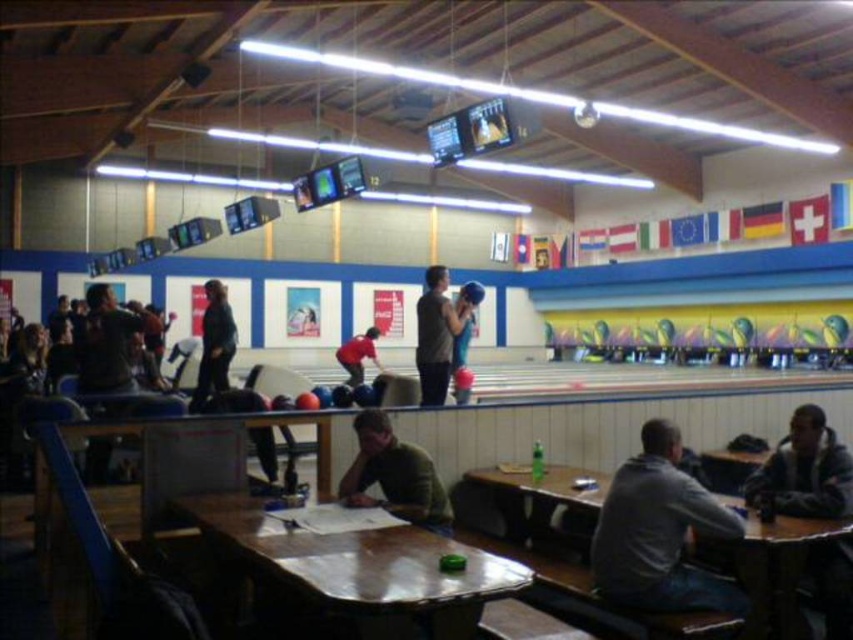
Question: Estimate the real-world distances between objects in this image. Which object is farther from the dark gray fabric jacket at center?

Choices:
 (A) blue fabric shirt at center
 (B) red fabric shirt at center
 (C) gray cotton shirt at lower right
 (D) matte blue bowling ball at center

Answer: (C)

Question: Can you confirm if blue fabric shirt at center is smaller than red fabric shirt at center?

Choices:
 (A) no
 (B) yes

Answer: (B)

Question: Is wooden table at lower right thinner than dark gray jacket at lower right?

Choices:
 (A) yes
 (B) no

Answer: (B)

Question: Considering the real-world distances, which object is farthest from the red fabric shirt at center?

Choices:
 (A) wooden table at center
 (B) gray cotton shirt at lower right

Answer: (A)

Question: Does wooden table at lower right appear over dark gray jacket at lower right?

Choices:
 (A) yes
 (B) no

Answer: (B)

Question: Considering the real-world distances, which object is farthest from the red fabric shirt at center?

Choices:
 (A) matte blue bowling ball at center
 (B) blue fabric shirt at center
 (C) wooden table at center

Answer: (C)